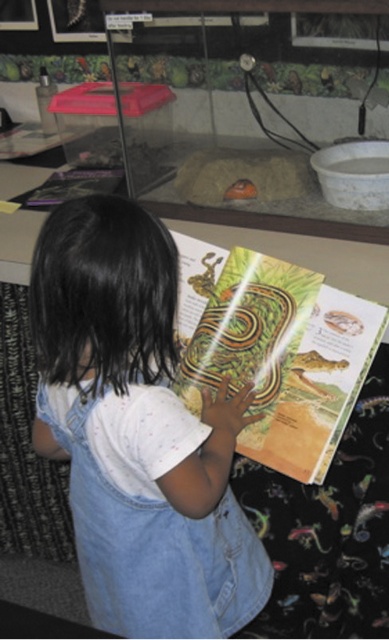
You are a photographer trying to capture a clear shot of the matte yellow book at center. Since the denim overalls at center is blocking part of the book, can you adjust your position to get a better view? Explain why or why not based on their positions.

The denim overalls at center is closer to the viewer than the matte yellow book at center. Therefore, moving your position slightly to the side might allow you to see around the denim overalls at center and get a clearer view of the matte yellow book at center.

You are a photographer trying to capture a closeup of the matte yellow book at center without including the denim overalls at center in the frame. Given their sizes, is this possible?

The denim overalls at center is wider than the matte yellow book at center, so it might be challenging to frame the book without including the overalls unless you adjust your angle or zoom in closely.